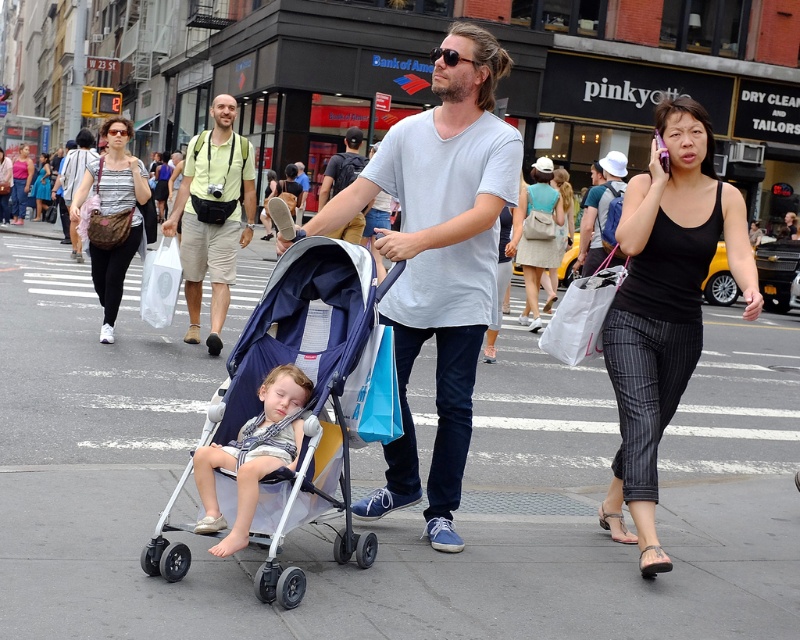
Question: Is matte blue stroller at center smaller than white fabric backpack at center?

Choices:
 (A) no
 (B) yes

Answer: (B)

Question: Can you confirm if matte blue stroller at center is positioned below turquoise fabric dress at center?

Choices:
 (A) no
 (B) yes

Answer: (B)

Question: Which point appears closest to the camera in this image?

Choices:
 (A) (404, 228)
 (B) (560, 198)
 (C) (196, 186)

Answer: (A)

Question: Does striped cotton shirt at center lie in front of matte black dress at center?

Choices:
 (A) no
 (B) yes

Answer: (B)

Question: Which point appears farthest from the camera in this image?

Choices:
 (A) (598, 204)
 (B) (124, 429)

Answer: (A)

Question: Among these objects, which one is nearest to the camera?

Choices:
 (A) black pinstripe pants at right
 (B) light gray cotton t-shirt at center
 (C) white fabric backpack at center

Answer: (B)